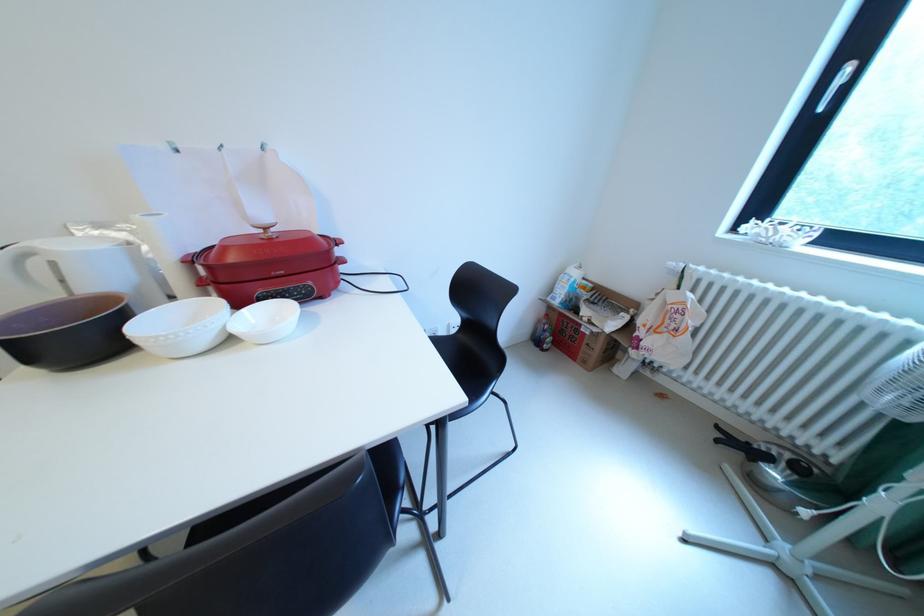
What do you see at coordinates (277, 244) in the screenshot? This screenshot has width=924, height=616. I see `the red pot lid handle` at bounding box center [277, 244].